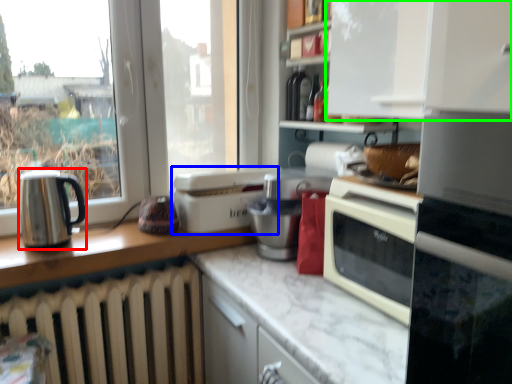
Question: Which object is the closest to the kitchen appliance (highlighted by a red box)? Choose among these: kitchen appliance (highlighted by a blue box) or cabinetry (highlighted by a green box).

Choices:
 (A) kitchen appliance
 (B) cabinetry

Answer: (A)